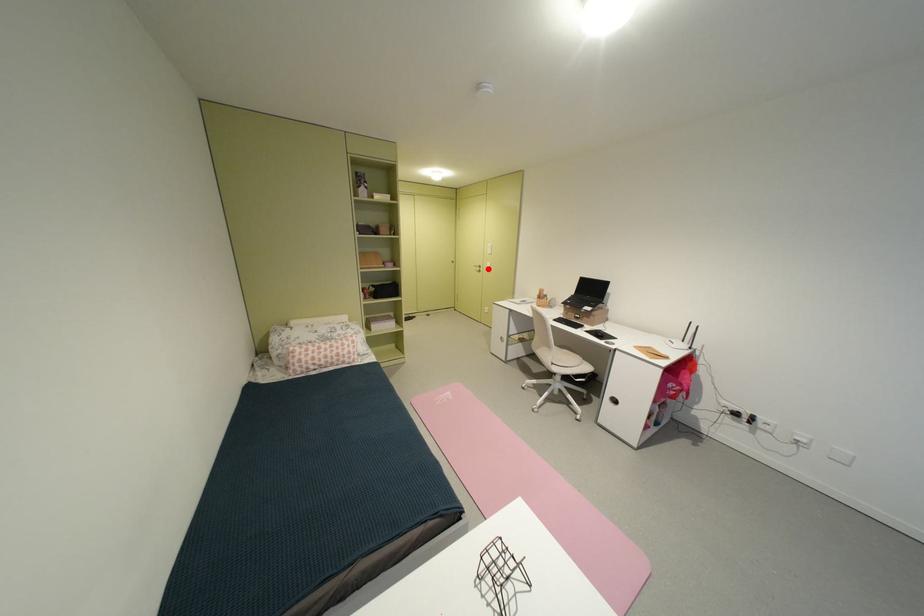
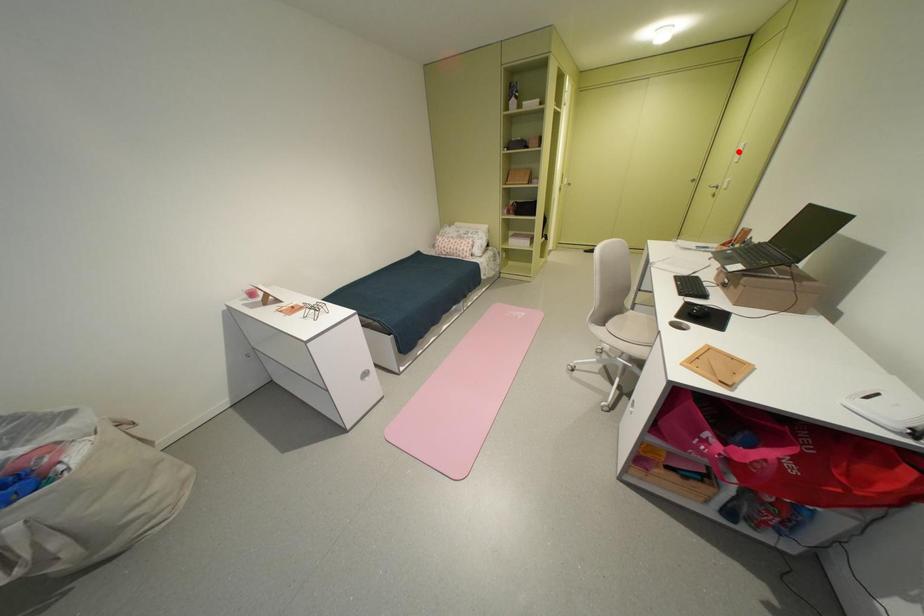
I am providing you with two images of the same scene from different viewpoints. A red point is marked on the first image and another point is marked on the second image. Is the marked point in image1 the same physical position as the marked point in image2?

No